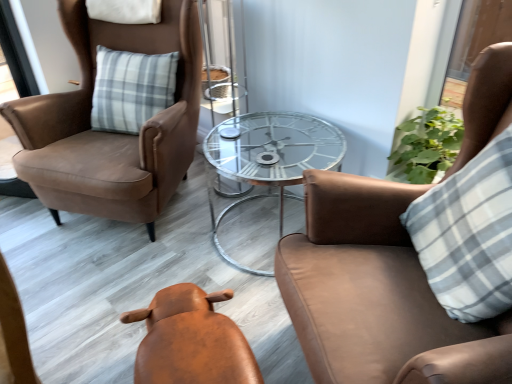
Question: In which direction should I rotate to look at leather stool at center, which is counted as the second chair, starting from the left?

Choices:
 (A) right
 (B) left

Answer: (B)

Question: From the image's perspective, is transparent glass table at center located beneath white checkered pillow at right?

Choices:
 (A) no
 (B) yes

Answer: (A)

Question: Is transparent glass table at center far from white checkered pillow at right?

Choices:
 (A) no
 (B) yes

Answer: (A)

Question: Considering the relative positions of transparent glass table at center and white checkered pillow at right in the image provided, is transparent glass table at center to the left of white checkered pillow at right from the viewer's perspective?

Choices:
 (A) no
 (B) yes

Answer: (B)

Question: From a real-world perspective, is transparent glass table at center positioned under white checkered pillow at right based on gravity?

Choices:
 (A) yes
 (B) no

Answer: (A)

Question: Is transparent glass table at center to the right of white checkered pillow at right from the viewer's perspective?

Choices:
 (A) no
 (B) yes

Answer: (A)

Question: From the image's perspective, is transparent glass table at center on top of white checkered pillow at right?

Choices:
 (A) yes
 (B) no

Answer: (A)

Question: Does brown leather chair at upper right, which ranks as the first chair in right-to-left order, have a smaller size compared to leather stool at center, which is counted as the second chair, starting from the left?

Choices:
 (A) yes
 (B) no

Answer: (B)

Question: Is brown leather chair at upper right, which ranks as the first chair in right-to-left order, placed right next to leather stool at center, which is counted as the second chair, starting from the left?

Choices:
 (A) no
 (B) yes

Answer: (A)

Question: Is brown leather chair at upper right, which ranks as the first chair in right-to-left order, oriented towards leather stool at center, which is counted as the second chair, starting from the left?

Choices:
 (A) no
 (B) yes

Answer: (B)

Question: Can leather stool at center, which appears as the 2th chair when viewed from the right, be found inside brown leather chair at upper right, which ranks as the first chair in right-to-left order?

Choices:
 (A) no
 (B) yes

Answer: (A)

Question: Can you confirm if brown leather chair at upper right, which ranks as the first chair in right-to-left order, is taller than leather stool at center, which is counted as the second chair, starting from the left?

Choices:
 (A) yes
 (B) no

Answer: (A)

Question: From a real-world perspective, does brown leather chair at upper right, which ranks as the first chair in right-to-left order, stand above leather stool at center, which appears as the 2th chair when viewed from the right?

Choices:
 (A) no
 (B) yes

Answer: (B)

Question: Can you confirm if suede brown armchair at left, marked as the first chair in a left-to-right arrangement, is wider than leather stool at center, which appears as the 2th chair when viewed from the right?

Choices:
 (A) no
 (B) yes

Answer: (B)